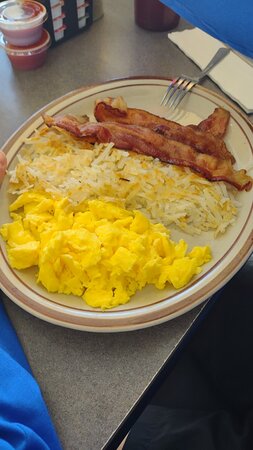
Locate an element on the screen. napkin is located at coordinates (196, 40).